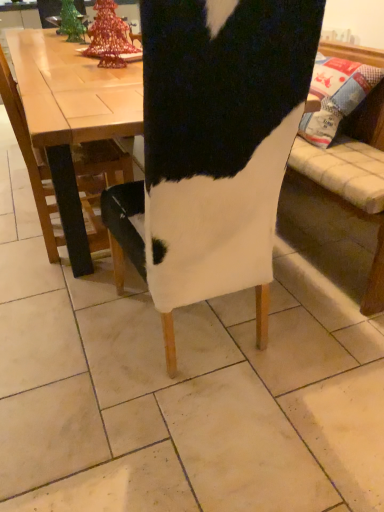
I want to click on free point to the left of white fabric chair at left, the 1th chair in the left-to-right sequence, so click(16, 230).